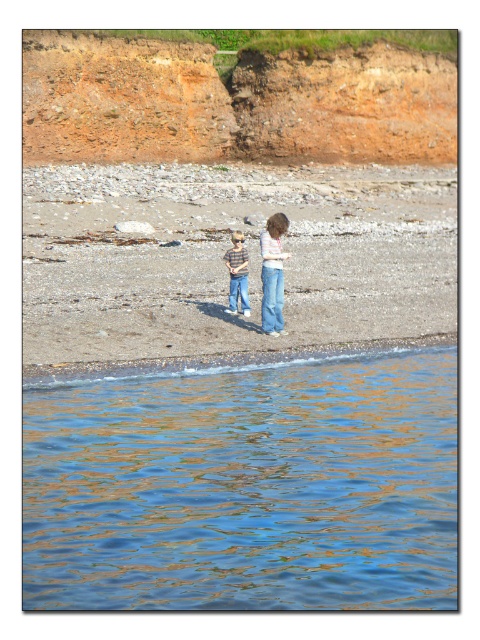
Can you confirm if white cotton shirt at center is smaller than blue denim jeans at center?

Yes, white cotton shirt at center is smaller than blue denim jeans at center.

Is point (273, 225) positioned in front of point (241, 285)?

Yes.

The image size is (480, 640). Find the location of `white cotton shirt at center`. white cotton shirt at center is located at coordinates (273, 273).

Does blue liquid water at lower left appear over smooth sand beach at center?

No, blue liquid water at lower left is not above smooth sand beach at center.

Is blue liquid water at lower left below smooth sand beach at center?

Indeed, blue liquid water at lower left is positioned under smooth sand beach at center.

You are a GUI agent. You are given a task and a screenshot of the screen. Output one action in this format:
    pyautogui.click(x=<x>, y=<y>)
    Task: Click on the blue liquid water at lower left
    Image resolution: width=480 pixels, height=640 pixels.
    Given the screenshot: What is the action you would take?
    pyautogui.click(x=244, y=486)

Does smooth sand beach at center have a lesser width compared to striped shirt jeans at center?

No, smooth sand beach at center is not thinner than striped shirt jeans at center.

This screenshot has width=480, height=640. Find the location of `smooth sand beach at center`. smooth sand beach at center is located at coordinates (226, 268).

This screenshot has height=640, width=480. Find the location of `smooth sand beach at center`. smooth sand beach at center is located at coordinates (226, 268).